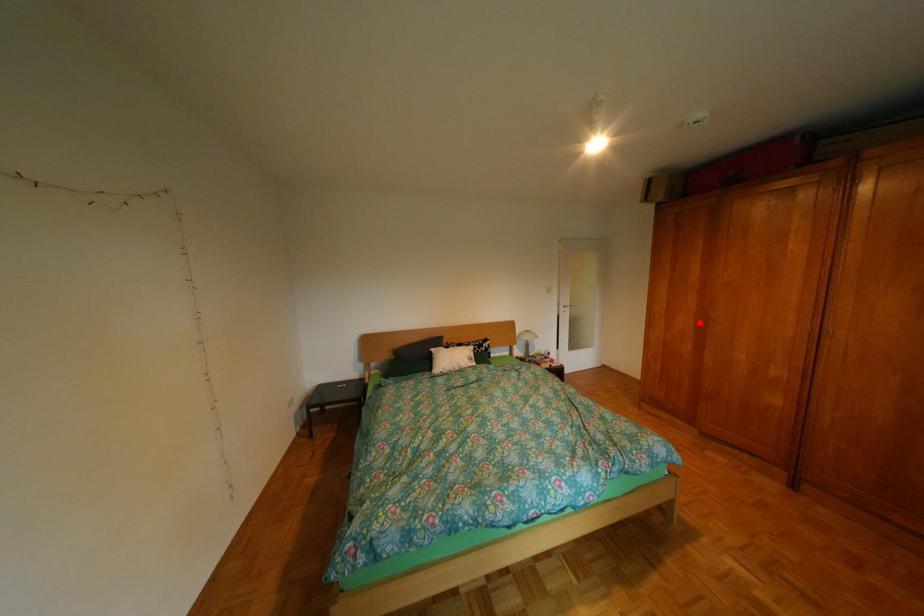
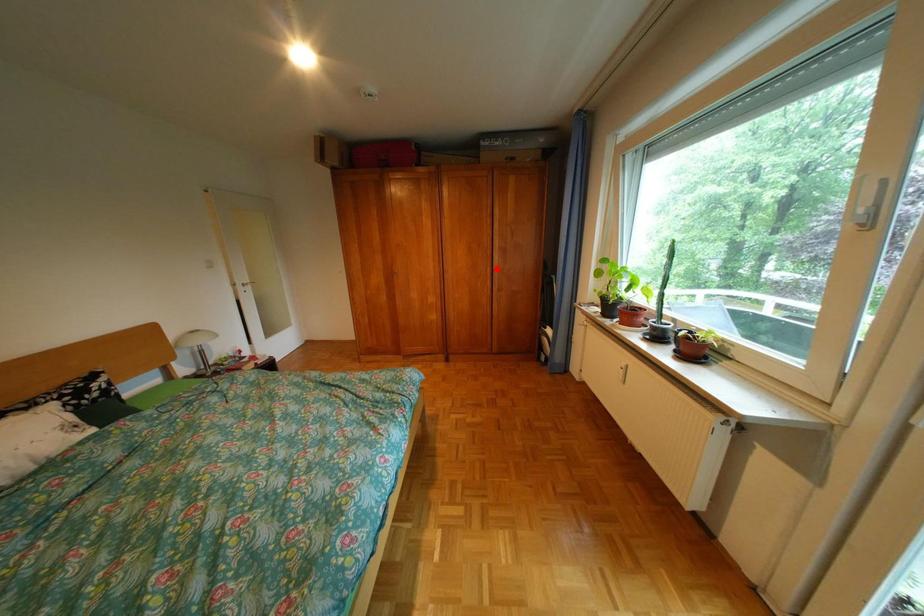
I am providing you with two images of the same scene from different viewpoints. A red point is marked on the first image and another point is marked on the second image. Does the point marked in image1 correspond to the same location as the one in image2?

No